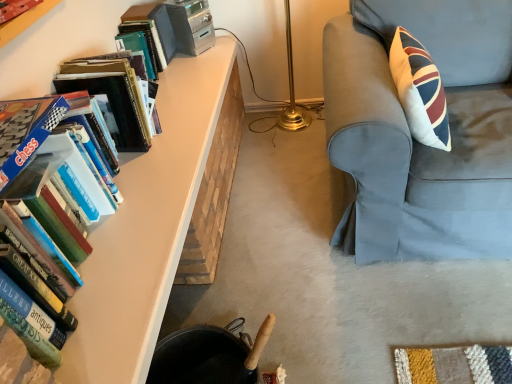
The image size is (512, 384). Find the location of `free spot to the left of gold metallic table lamp at center`. free spot to the left of gold metallic table lamp at center is located at coordinates (257, 150).